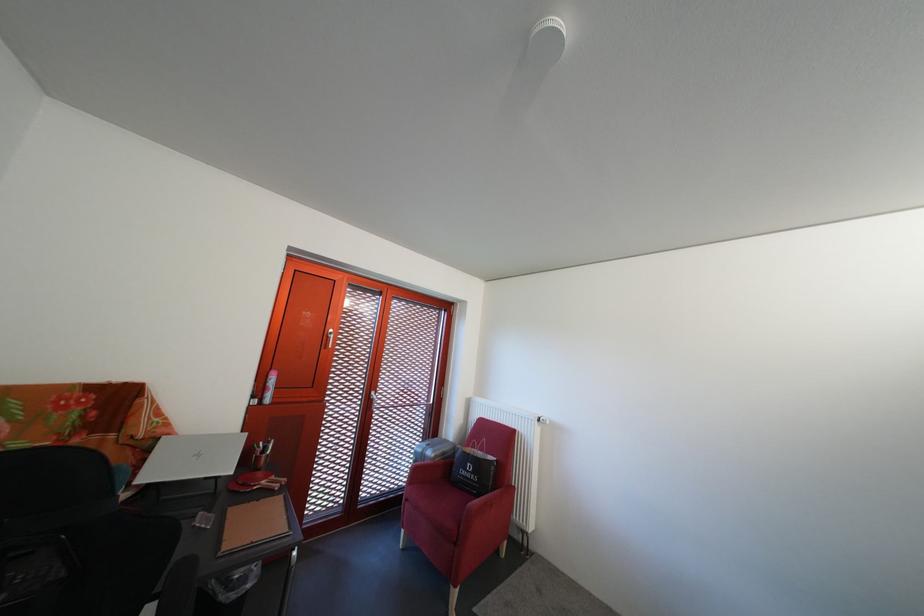
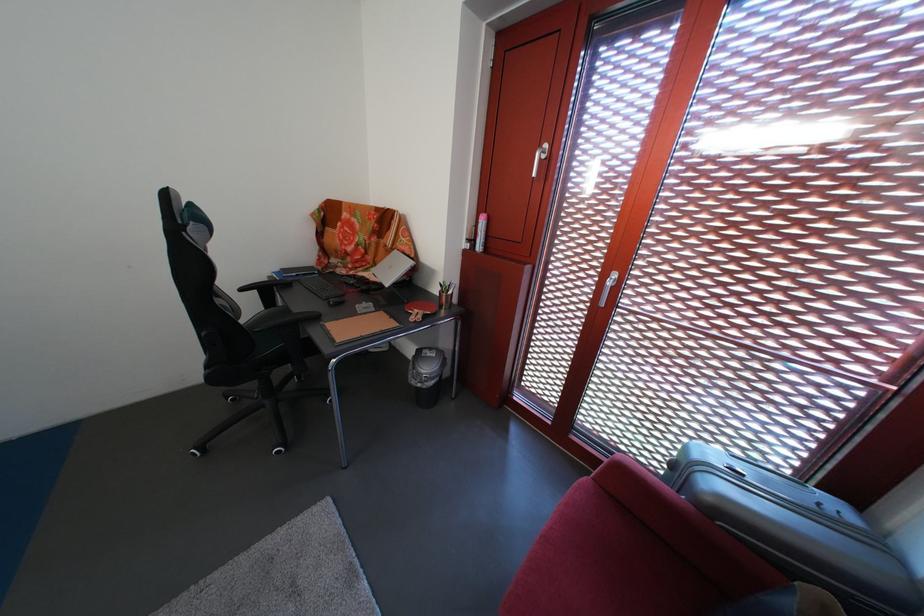
Locate, in the second image, the point that corresponds to [263,403] in the first image.

(479, 246)